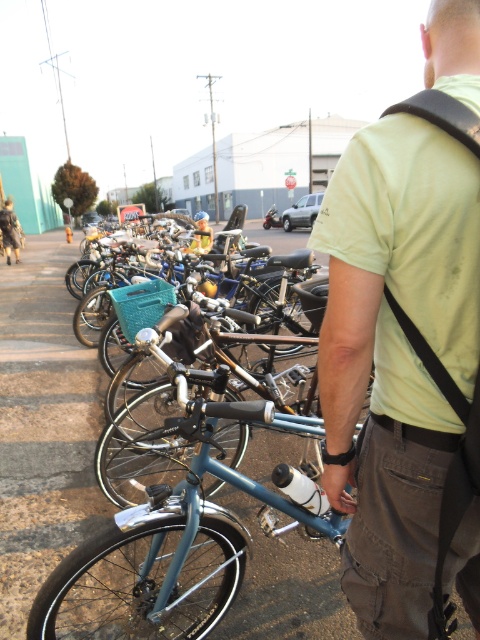
Can you confirm if brown leather jacket at upper left is bigger than matte plastic bicycle at center?

Yes.

From the picture: Between brown leather jacket at upper left and matte plastic bicycle at center, which one appears on the left side from the viewer's perspective?

From the viewer's perspective, brown leather jacket at upper left appears more on the left side.

Who is more distant from viewer, [16,248] or [195,246]?

Positioned behind is point [16,248].

At what (x,y) coordinates should I click in order to perform the action: click on brown leather jacket at upper left. Please return your answer as a coordinate pair (x, y). Image resolution: width=480 pixels, height=640 pixels. Looking at the image, I should click on (10, 230).

Which of these two, light green t-shirt at center or matte plastic bicycle at center, stands taller?

Standing taller between the two is light green t-shirt at center.

Does light green t-shirt at center appear on the left side of matte plastic bicycle at center?

Incorrect, light green t-shirt at center is not on the left side of matte plastic bicycle at center.

Describe the element at coordinates (396, 355) in the screenshot. I see `light green t-shirt at center` at that location.

You are a GUI agent. You are given a task and a screenshot of the screen. Output one action in this format:
    pyautogui.click(x=<x>, y=<y>)
    Task: Click on the light green t-shirt at center
    This screenshot has width=480, height=640.
    Given the screenshot: What is the action you would take?
    pyautogui.click(x=396, y=355)

Does point (417, 273) come in front of point (10, 209)?

Yes, point (417, 273) is closer to viewer.

Image resolution: width=480 pixels, height=640 pixels. What are the coordinates of `light green t-shirt at center` in the screenshot? It's located at (396, 355).

Find the location of a particular element. Image resolution: width=480 pixels, height=640 pixels. light green t-shirt at center is located at coordinates (396, 355).